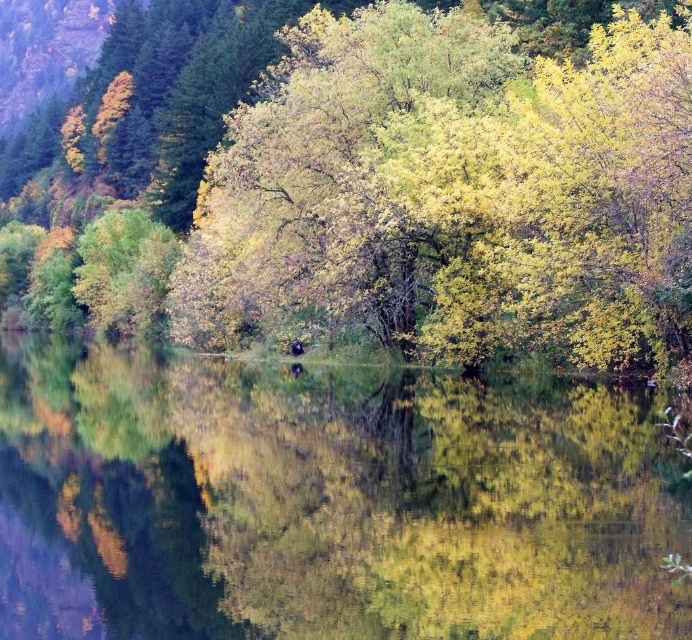
You are standing at the camera position and want to reach the point marked at coordinates point (316, 496). If you walk straight ahead, will you reach that point?

Yes, because the point marked at coordinates point (316, 496) is 30.31 meters away from the camera position, so walking straight ahead will lead you to it.

You are standing at the edge of the green reflective water at center and want to reach a small wooden bench located 18 meters away. Can you walk directly to the bench without crossing any obstacles?

The distance between you and the bench is 17.99 meters, so yes, you can walk directly to the bench without crossing any obstacles since it is within the 18 meters range.

You are standing at the origin point of the coordinate system in the scene. You want to place a small floating dock on the green reflective water at center. What are the coordinates where you should place it?

The coordinates for placing the small floating dock on the green reflective water at center are at point (327, 500).